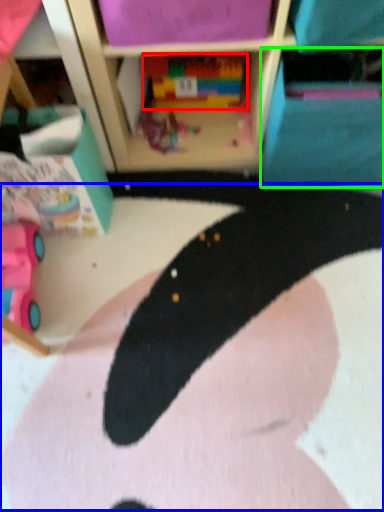
Question: Which is nearer to the toy (highlighted by a red box)? animal (highlighted by a blue box) or cabinet (highlighted by a green box).

Choices:
 (A) animal
 (B) cabinet

Answer: (B)